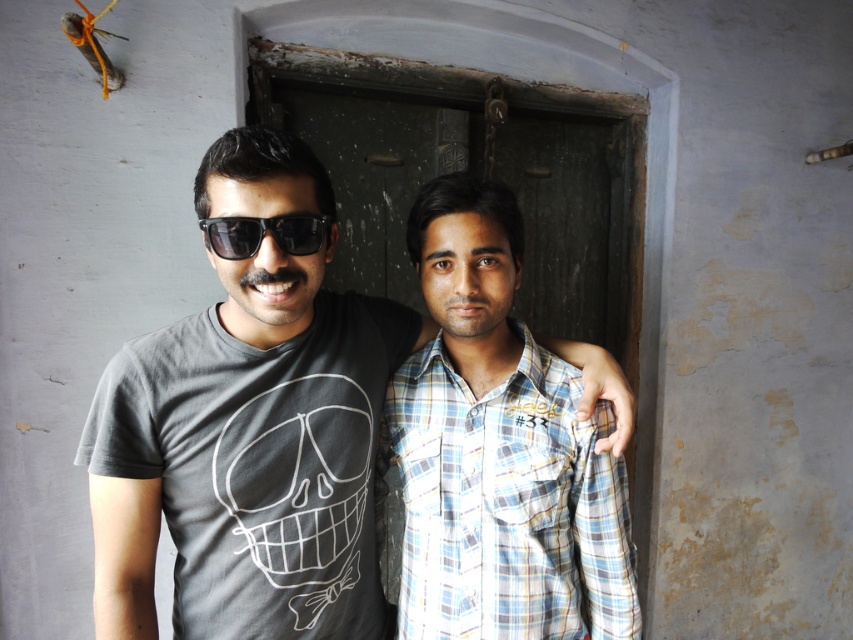
Question: Among these objects, which one is farthest from the camera?

Choices:
 (A) black plastic sunglasses at center
 (B) gray matte t-shirt at center

Answer: (B)

Question: Is the position of gray matte t-shirt at center more distant than that of black plastic sunglasses at center?

Choices:
 (A) yes
 (B) no

Answer: (A)

Question: Which point is closer to the camera taking this photo?

Choices:
 (A) (250, 525)
 (B) (325, 225)

Answer: (B)

Question: Can you confirm if gray matte t-shirt at center is positioned above black plastic sunglasses at center?

Choices:
 (A) no
 (B) yes

Answer: (A)

Question: Is gray matte t-shirt at center wider than plaid shirt at center?

Choices:
 (A) yes
 (B) no

Answer: (A)

Question: Based on their relative distances, which object is farther from the black plastic sunglasses at center?

Choices:
 (A) gray matte t-shirt at center
 (B) plaid shirt at center

Answer: (B)